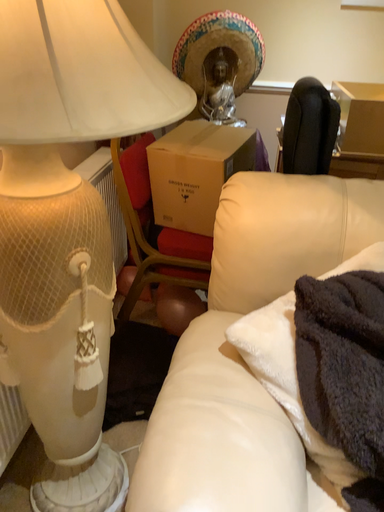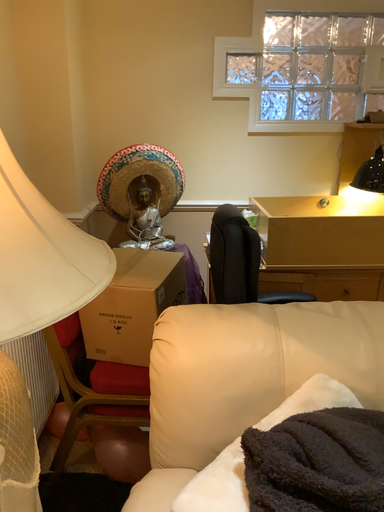
Question: Which way did the camera rotate in the video?

Choices:
 (A) rotated left
 (B) rotated right

Answer: (B)